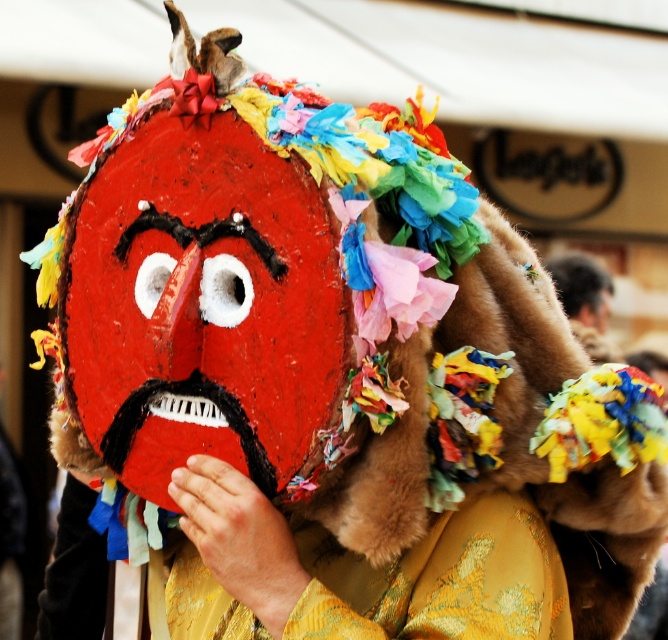
Question: Which point is farther to the camera?

Choices:
 (A) multicolored paper mask at center
 (B) furry head at upper right
 (C) matte papier-mâché mask at center

Answer: (B)

Question: Which is farther from the furry head at upper right?

Choices:
 (A) matte red mask at center
 (B) matte papier-mâché mask at center

Answer: (A)

Question: Which of the following is the closest to the observer?

Choices:
 (A) matte papier-mâché mask at center
 (B) multicolored paper mask at center

Answer: (B)

Question: Observing the image, what is the correct spatial positioning of matte red mask at center in reference to multicolored paper mask at center?

Choices:
 (A) left
 (B) right

Answer: (A)

Question: Is matte papier-mâché mask at center positioned at the back of multicolored paper mask at center?

Choices:
 (A) no
 (B) yes

Answer: (B)

Question: Does matte papier-mâché mask at center have a greater width compared to matte red mask at center?

Choices:
 (A) no
 (B) yes

Answer: (B)